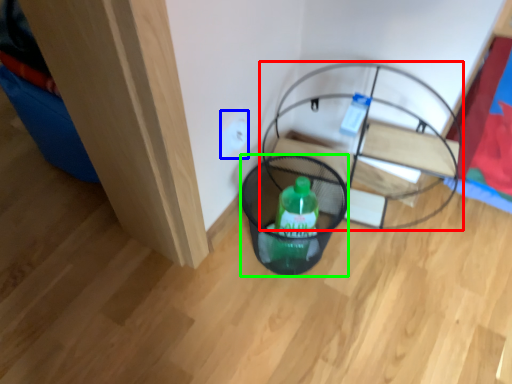
Question: Which object is positioned farthest from furniture (highlighted by a red box)? Select from electric outlet (highlighted by a blue box) and basket (highlighted by a green box).

Choices:
 (A) electric outlet
 (B) basket

Answer: (A)